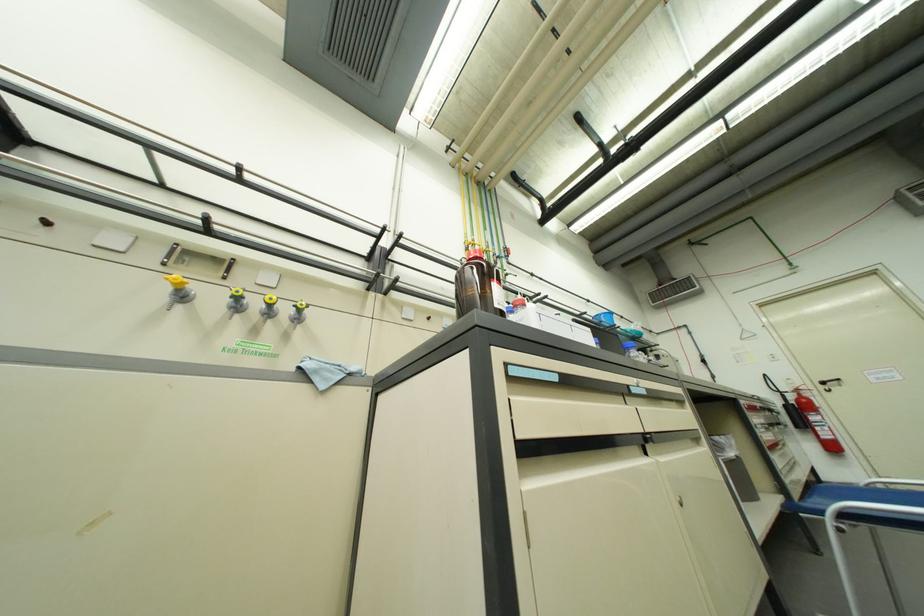
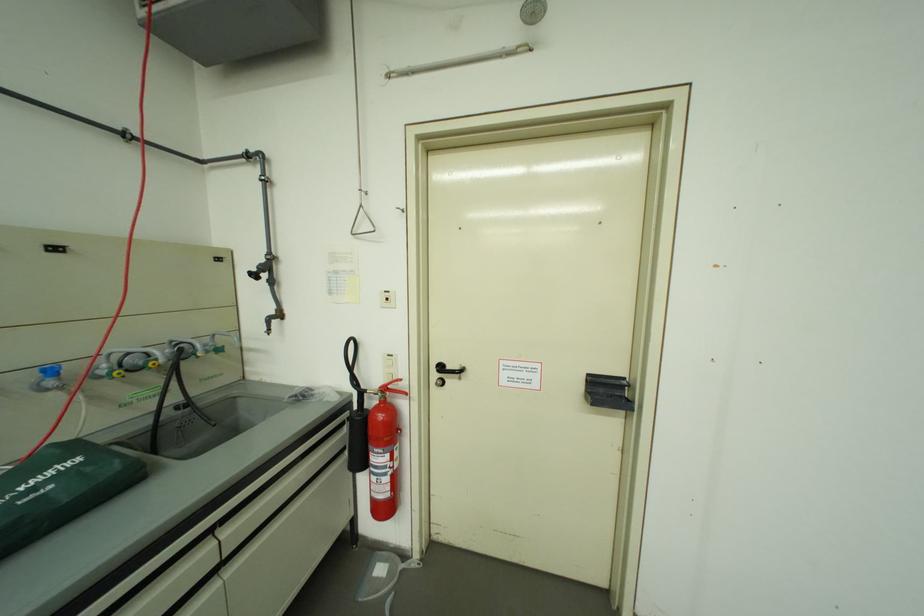
Find the pixel in the second image that matches (807,392) in the first image.

(394, 391)